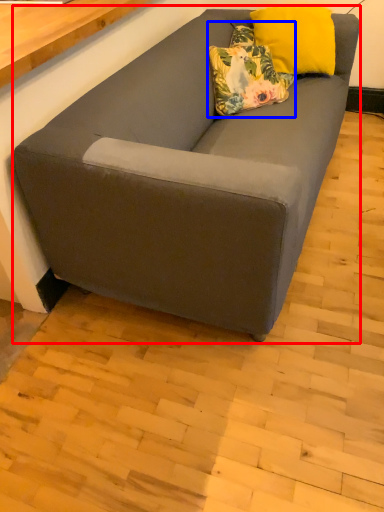
Question: Which of the following is the farthest to the observer, studio couch (highlighted by a red box) or pillow (highlighted by a blue box)?

Choices:
 (A) studio couch
 (B) pillow

Answer: (B)